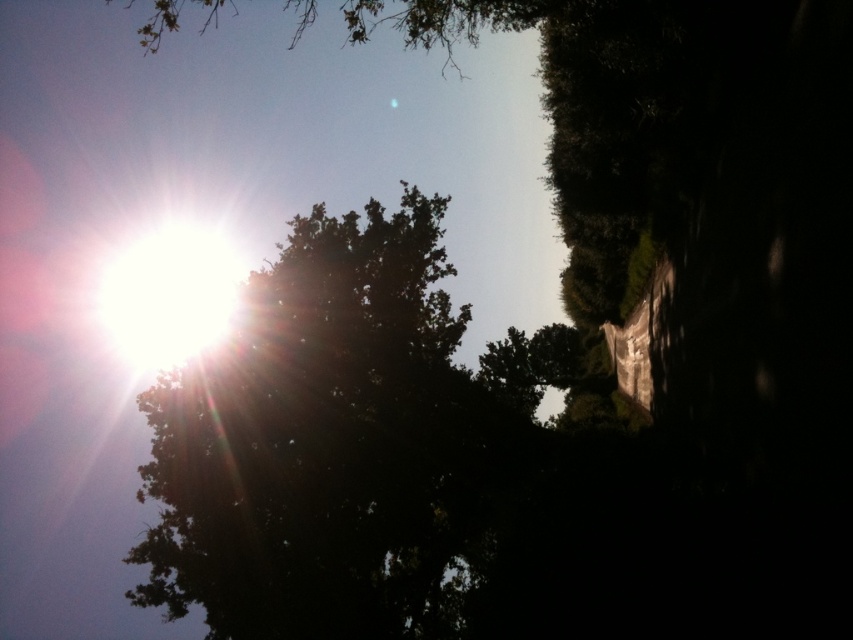
You are an astronomer observing the sky and notice the dark green leafy tree at upper center and the bright white sun at upper left. Based on their positions, which object is closer to the left side of the image?

The bright white sun at upper left is closer to the left side of the image because it is positioned to the left of the dark green leafy tree at upper center.

You are an astronomer analyzing the position of the sun in the sky relative to the dark green leafy tree at upper center. Based on the scene, where would you estimate the sun is located in relation to the tree?

The sun is in the upper left quadrant, so it is positioned to the left and above the dark green leafy tree at upper center.